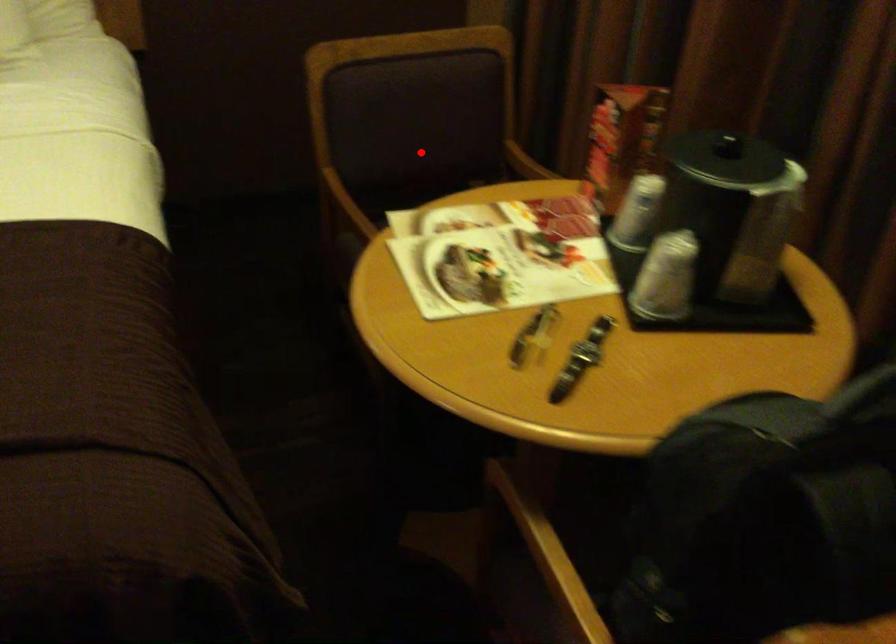
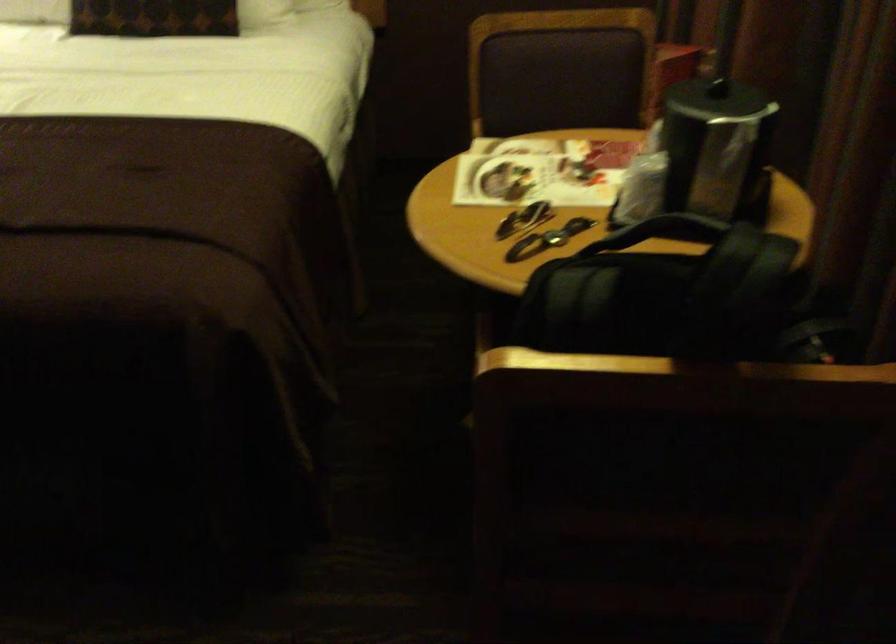
Question: A red point is marked in image1. In image2, is the corresponding 3D point closer to the camera or farther? Reply with the corresponding letter.

Choices:
 (A) The corresponding 3D point is closer.
 (B) The corresponding 3D point is farther.

Answer: (B)